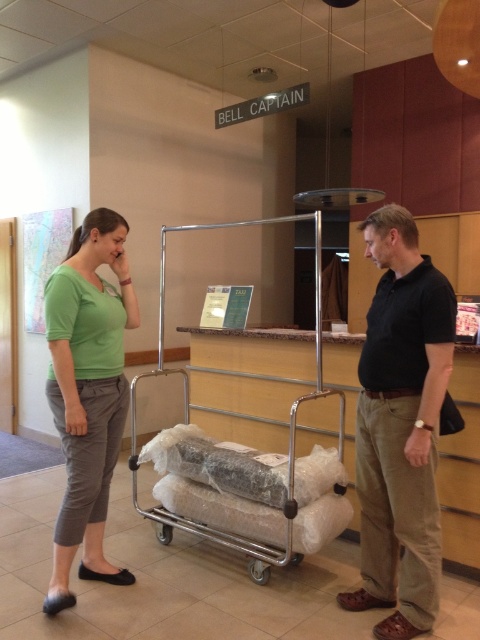
You are a guest in the hotel lobby and see the black cotton shirt at center and the green matte shirt at left. Which shirt is positioned lower in the image?

The black cotton shirt at center is positioned lower than the green matte shirt at left.

You are a hotel guest who just arrived and needs to check in. You are standing near the green matte shirt at left. The reception desk is behind the silver metallic luggage cart at center. Can you comfortably walk to the desk without moving the luggage cart?

The distance between the green matte shirt at left and the silver metallic luggage cart at center is 23.58 inches. Since this distance is quite narrow, you would likely need to move the silver metallic luggage cart at center to comfortably reach the reception desk.